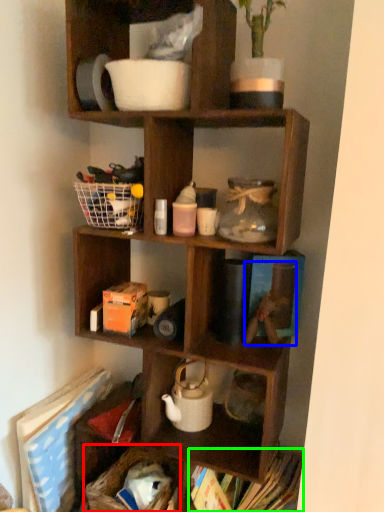
Question: Estimate the real-world distances between objects in this image. Which object is farther from basket (highlighted by a red box), toy (highlighted by a blue box) or book (highlighted by a green box)?

Choices:
 (A) toy
 (B) book

Answer: (A)